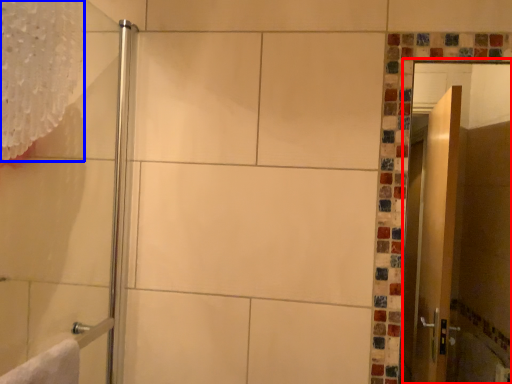
Question: Which object appears farthest to the camera in this image, screen door (highlighted by a red box) or shower curtain (highlighted by a blue box)?

Choices:
 (A) screen door
 (B) shower curtain

Answer: (A)